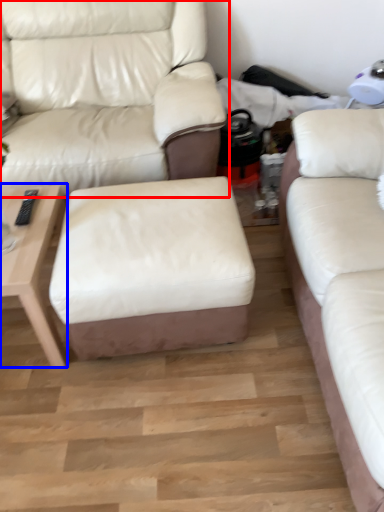
Question: Which object appears farthest to the camera in this image, studio couch (highlighted by a red box) or table (highlighted by a blue box)?

Choices:
 (A) studio couch
 (B) table

Answer: (A)